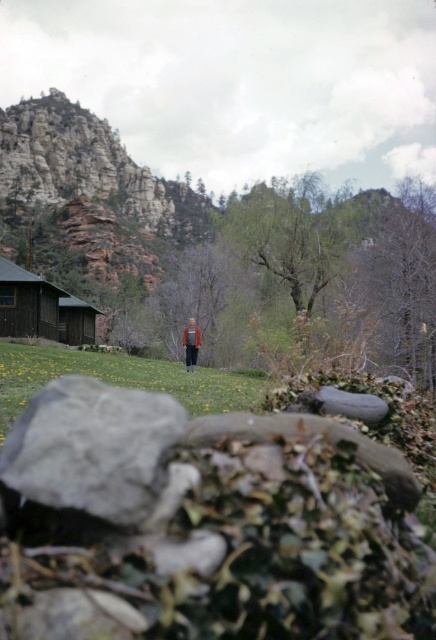
Between gray rough rock at lower left and green grass at center, which one is positioned higher?

gray rough rock at lower left is above.

The image size is (436, 640). What do you see at coordinates (92, 448) in the screenshot?
I see `gray rough rock at lower left` at bounding box center [92, 448].

Find the location of a particular element. The width and height of the screenshot is (436, 640). gray rough rock at lower left is located at coordinates (92, 448).

Does gray rough rock at lower left have a smaller size compared to dark brown wooden cabin at left?

No.

Is point (111, 410) closer to camera compared to point (34, 317)?

Yes.

This screenshot has width=436, height=640. What are the coordinates of `gray rough rock at lower left` in the screenshot? It's located at pos(92,448).

The image size is (436, 640). Find the location of `gray rough rock at lower left`. gray rough rock at lower left is located at coordinates (92, 448).

Locate an element on the screen. gray rough rock at lower left is located at coordinates (92, 448).

Which is below, gray rough rock at lower left or dark brown leather jacket at center?

gray rough rock at lower left

Measure the distance between point [105,481] and camera.

The distance of point [105,481] from camera is 111.42 feet.

Locate an element on the screen. gray rough rock at lower left is located at coordinates (92, 448).